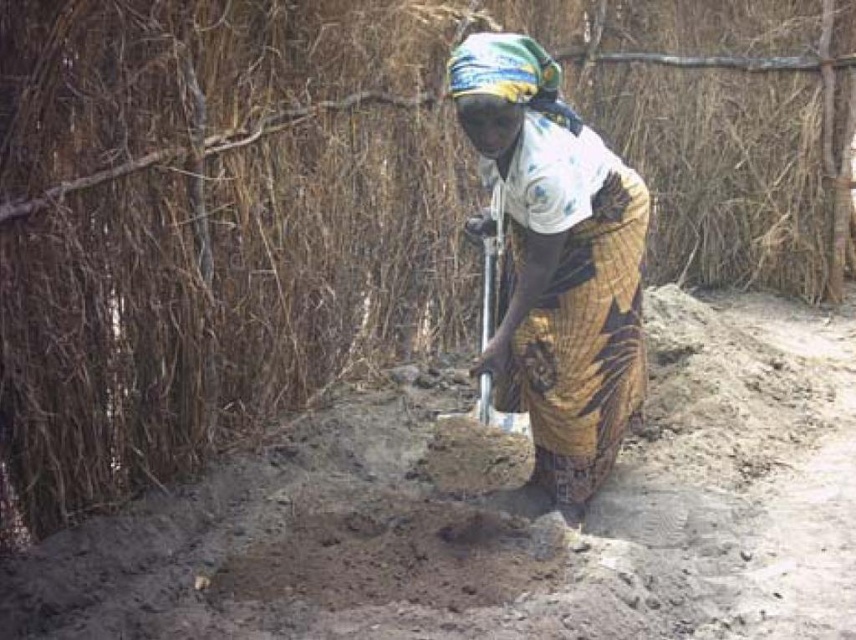
Question: Which point is farther to the camera?

Choices:
 (A) (498, 262)
 (B) (566, 259)

Answer: (A)

Question: Does printed cotton dress at center have a smaller size compared to metallic silver shovel at center?

Choices:
 (A) no
 (B) yes

Answer: (A)

Question: Among these objects, which one is farthest from the camera?

Choices:
 (A) printed cotton dress at center
 (B) metallic silver shovel at center

Answer: (B)

Question: Observing the image, what is the correct spatial positioning of printed cotton dress at center in reference to metallic silver shovel at center?

Choices:
 (A) below
 (B) above

Answer: (B)

Question: Which of the following is the closest to the observer?

Choices:
 (A) (498, 244)
 (B) (520, 488)

Answer: (A)

Question: Can you confirm if printed cotton dress at center is positioned below metallic silver shovel at center?

Choices:
 (A) yes
 (B) no

Answer: (B)